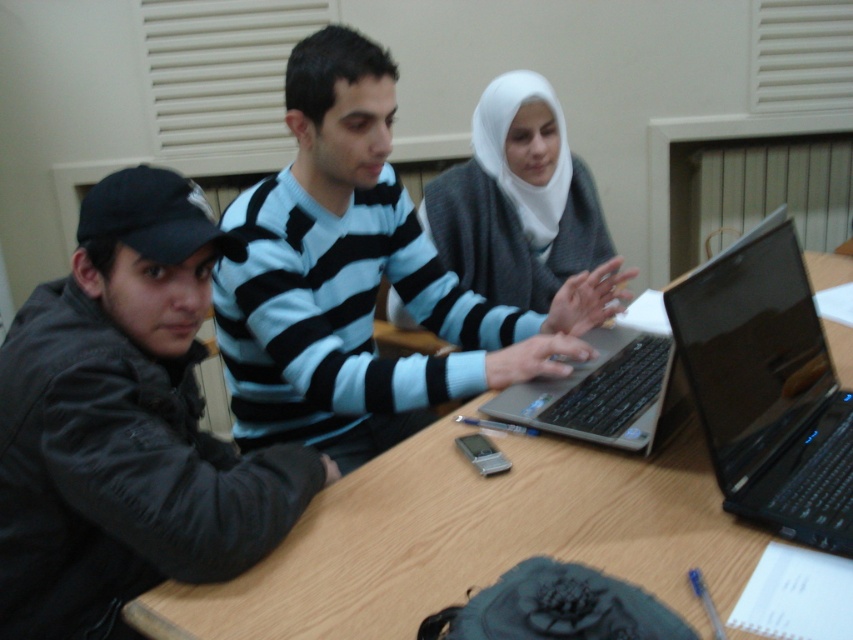
Who is taller, light blue striped sweater at center or white matte hijab at center?

light blue striped sweater at center is taller.

Does light blue striped sweater at center have a greater height compared to white matte hijab at center?

Yes, light blue striped sweater at center is taller than white matte hijab at center.

Between point (265, 216) and point (573, 195), which one is positioned in front?

Point (265, 216) is more forward.

Identify the location of light blue striped sweater at center. The height and width of the screenshot is (640, 853). (363, 280).

Which of these two, dark gray jacket at left or wooden table at center, stands shorter?

wooden table at center is shorter.

From the picture: Is dark gray jacket at left thinner than wooden table at center?

Yes, dark gray jacket at left is thinner than wooden table at center.

Who is more forward, (158, 276) or (401, 586)?

Point (401, 586)

Locate an element on the screen. The height and width of the screenshot is (640, 853). dark gray jacket at left is located at coordinates (126, 424).

Is light blue striped sweater at center in front of black glossy laptop at right?

No, it is not.

The width and height of the screenshot is (853, 640). I want to click on light blue striped sweater at center, so click(x=363, y=280).